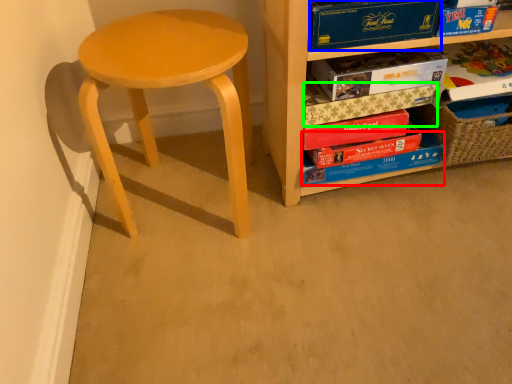
Question: Considering the real-world distances, which object is closest to paperback book (highlighted by a red box)? paperback book (highlighted by a blue box) or paperback book (highlighted by a green box).

Choices:
 (A) paperback book
 (B) paperback book

Answer: (B)